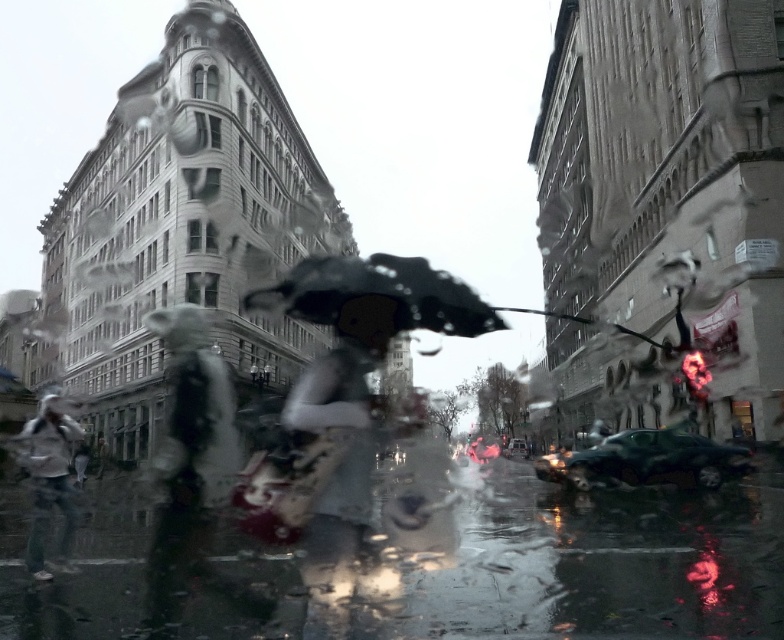
Is matte black umbrella at center further to the viewer compared to transparent plastic umbrella at center?

No, it is in front of transparent plastic umbrella at center.

Can you confirm if matte black umbrella at center is positioned to the left of transparent plastic umbrella at center?

No, matte black umbrella at center is not to the left of transparent plastic umbrella at center.

Who is more distant from viewer, [300,376] or [423,296]?

The point [300,376] is behind.

The width and height of the screenshot is (784, 640). In order to click on matte black umbrella at center in this screenshot , I will do (x=340, y=458).

Between dark gray fabric umbrella at center and matte black umbrella at center, which one has less height?

matte black umbrella at center

Is dark gray fabric umbrella at center bigger than matte black umbrella at center?

Indeed, dark gray fabric umbrella at center has a larger size compared to matte black umbrella at center.

The height and width of the screenshot is (640, 784). Identify the location of dark gray fabric umbrella at center. (191, 470).

Does transparent plastic umbrella at center appear on the right side of white matte jacket at left?

Correct, you'll find transparent plastic umbrella at center to the right of white matte jacket at left.

Between transparent plastic umbrella at center and white matte jacket at left, which one is positioned lower?

white matte jacket at left is lower down.

Find the location of a particular element. This screenshot has width=784, height=640. transparent plastic umbrella at center is located at coordinates (376, 300).